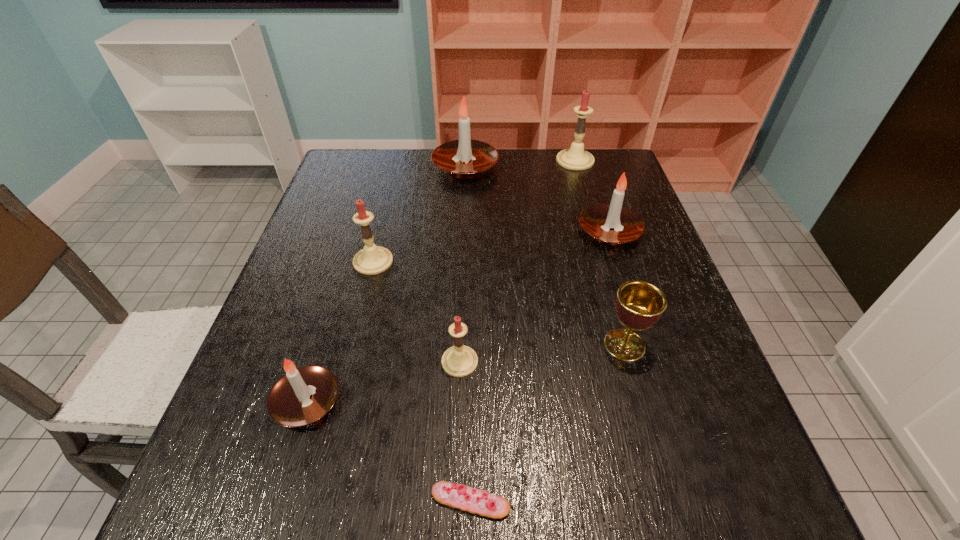
Identify the location of free region at the far right corner. (594, 176).

Identify the location of free region at the near right corner of the desktop. The height and width of the screenshot is (540, 960). (740, 522).

Where is `vacant area that lies between the second smallest red candle and the golden chalice`? The width and height of the screenshot is (960, 540). vacant area that lies between the second smallest red candle and the golden chalice is located at coordinates (499, 303).

Locate an element on the screen. This screenshot has height=540, width=960. free space between the nearest white candle and the biggest white candle is located at coordinates (386, 284).

Locate an element on the screen. free point between the eclair and the second biggest white candle is located at coordinates (540, 366).

Identify the location of free spot between the eclair and the second red candle from left to right. (466, 431).

Find the location of a particular element. This screenshot has height=540, width=960. free space between the second white candle from right to left and the second nearest white candle is located at coordinates (538, 199).

Where is `vacant area that lies between the smallest red candle and the chalice`? This screenshot has width=960, height=540. vacant area that lies between the smallest red candle and the chalice is located at coordinates (542, 353).

At what (x,y) coordinates should I click in order to perform the action: click on unoccupied position between the smallest white candle and the rightmost red candle. Please return your answer as a coordinate pair (x, y). Looking at the image, I should click on (441, 281).

Identify the location of free area in between the second smallest white candle and the biggest white candle. (538, 199).